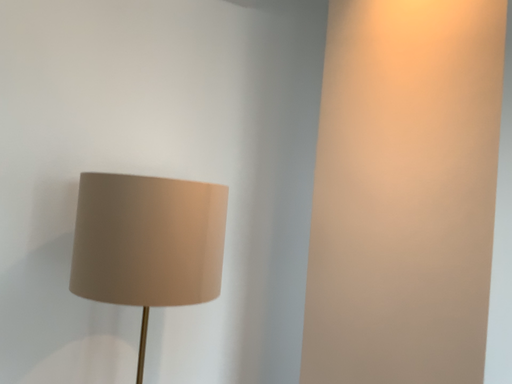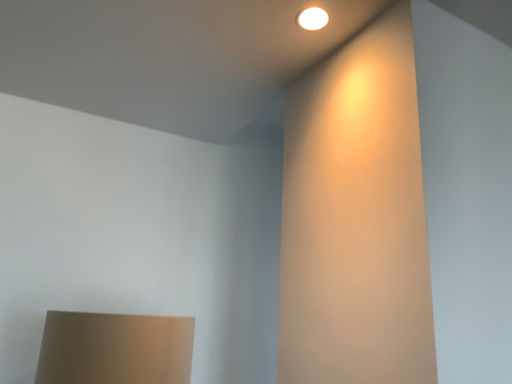
Question: Which way did the camera rotate in the video?

Choices:
 (A) rotated downward
 (B) rotated upward

Answer: (B)